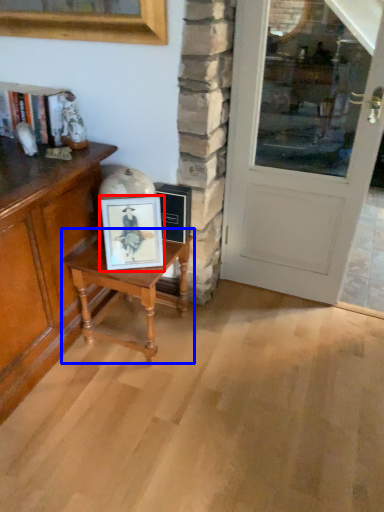
Question: Which of the following is the closest to the observer, picture frame (highlighted by a red box) or table (highlighted by a blue box)?

Choices:
 (A) picture frame
 (B) table

Answer: (A)